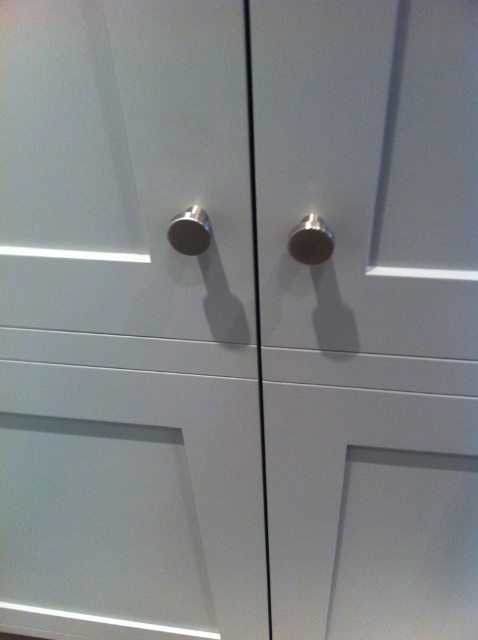
You are an interior designer planning to install a new cabinet knob. You have a design requirement that the knob must be placed exactly at the center of the cabinet door. Based on the image, is the current metallic silver knob at center positioned correctly?

The metallic silver knob at center is positioned at point (369, 314), which is very close to the center coordinates of (239, 320). Therefore, it is correctly placed at the center of the cabinet door.

You are standing in front of two white cabinet doors with simple designs. You notice two points marked on the doors at coordinates point (315,240) and point (182,248). Which point is closer to you?

Point (315,240) is closer to the viewer than point (182,248).

In the scene shown: You are an interior designer examining two points on the cabinet doors. You need to determine which point is closer to you. The points are labeled as point 1 at coordinates point (296, 26) and point 2 at coordinates point (316, 248). Which point is closer to you?

Point (296, 26) is closer to the viewer than point (316, 248).